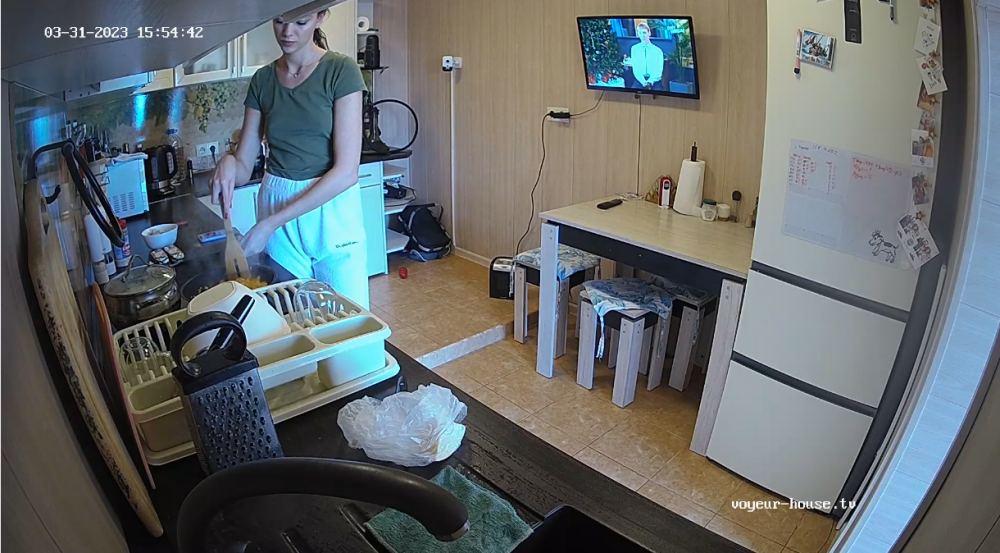
The height and width of the screenshot is (553, 1000). In order to click on this woman is cooking something on a stovetop in this screenshot , I will do `click(288, 156)`, `click(235, 266)`.